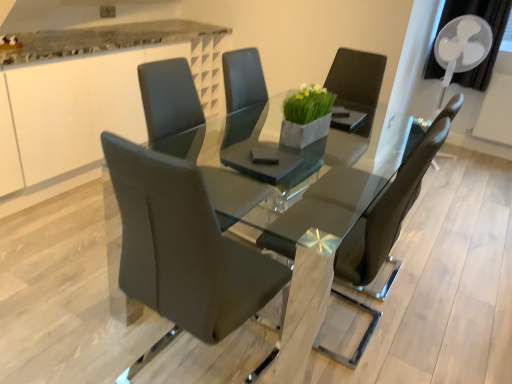
Locate an element on the screen. The image size is (512, 384). white plastic mechanical fan at upper right is located at coordinates (461, 46).

The width and height of the screenshot is (512, 384). What are the coordinates of `matte black chair at center, which is the 2th chair in front-to-back order` in the screenshot? It's located at (386, 218).

Locate an element on the screen. white plastic mechanical fan at upper right is located at coordinates (461, 46).

Which point is more distant from viewer, (458, 56) or (362, 254)?

Point (458, 56)

Based on the photo, considering the sizes of objects white plastic mechanical fan at upper right and matte black chair at center, which is counted as the 2th chair, starting from the back, in the image provided, who is thinner, white plastic mechanical fan at upper right or matte black chair at center, which is counted as the 2th chair, starting from the back,?

Thinner between the two is white plastic mechanical fan at upper right.

How distant is white plastic mechanical fan at upper right from matte black chair at center, which is counted as the 2th chair, starting from the back?

They are 7.02 feet apart.

How different are the orientations of white plastic mechanical fan at upper right and matte black chair at center, which is the 2th chair in front-to-back order, in degrees?

91.6 degrees.

Consider the image. Which object is positioned more to the left, matte black chair at center, which is the 2th chair in front-to-back order, or matte black chair at center, the third chair viewed from the back?

matte black chair at center, the third chair viewed from the back, is more to the left.

From the image's perspective, is matte black chair at center, which is the 2th chair in front-to-back order, positioned above or below matte black chair at center, the third chair viewed from the back?

Clearly, from the image's perspective, matte black chair at center, which is the 2th chair in front-to-back order, is above matte black chair at center, the third chair viewed from the back.

Between point (366, 264) and point (120, 181), which one is positioned in front?

The point (120, 181) is more forward.

Between matte black chair at center, which is the 2th chair in front-to-back order, and matte black chair at center, which is counted as the first chair, starting from the front, which one has less height?

matte black chair at center, which is counted as the first chair, starting from the front.

Consider the image. From a real-world perspective, does white plastic mechanical fan at upper right sit lower than matte black chair at center, which is counted as the first chair, starting from the front?

Incorrect, from a real-world perspective, white plastic mechanical fan at upper right is higher than matte black chair at center, which is counted as the first chair, starting from the front.

Considering the relative sizes of white plastic mechanical fan at upper right and matte black chair at center, which is counted as the first chair, starting from the front, in the image provided, is white plastic mechanical fan at upper right shorter than matte black chair at center, which is counted as the first chair, starting from the front,?

Yes, white plastic mechanical fan at upper right is shorter than matte black chair at center, which is counted as the first chair, starting from the front.

The width and height of the screenshot is (512, 384). What are the coordinates of `mechanical fan lying on the right of matte black chair at center, which is counted as the first chair, starting from the front` in the screenshot? It's located at (461, 46).

Between point (482, 30) and point (240, 312), which one is positioned behind?

The point (482, 30) is farther.

From the image's perspective, is white plastic mechanical fan at upper right on high-gloss black table at center?

Yes, from the image's perspective, white plastic mechanical fan at upper right is on top of high-gloss black table at center.

Is matte black chair at center, positioned as the third chair in front-to-back order, completely or partially inside white plastic mechanical fan at upper right?

No.

In the image, is white plastic mechanical fan at upper right positioned in front of or behind matte black chair at center, placed as the first chair when sorted from back to front?

white plastic mechanical fan at upper right is behind matte black chair at center, placed as the first chair when sorted from back to front.

Is point (456, 43) less distant than point (242, 146)?

No, (456, 43) is further to viewer.

Is high-gloss black table at center inside the boundaries of white glossy counter at upper left, or outside?

high-gloss black table at center is not inside white glossy counter at upper left, it's outside.

Can you confirm if high-gloss black table at center is wider than white glossy counter at upper left?

Correct, the width of high-gloss black table at center exceeds that of white glossy counter at upper left.

Does high-gloss black table at center come behind white glossy counter at upper left?

No, it is not.

Is point (410, 184) positioned behind point (41, 50)?

No, (410, 184) is closer to viewer.

Is matte black chair at center, positioned as the third chair in front-to-back order, touching white glossy counter at upper left?

matte black chair at center, positioned as the third chair in front-to-back order, is not next to white glossy counter at upper left, and they're not touching.

Looking at this image, is matte black chair at center, placed as the first chair when sorted from back to front, in front of or behind white glossy counter at upper left in the image?

In the image, matte black chair at center, placed as the first chair when sorted from back to front, appears in front of white glossy counter at upper left.

Considering the sizes of objects matte black chair at center, placed as the first chair when sorted from back to front, and white glossy counter at upper left in the image provided, who is taller, matte black chair at center, placed as the first chair when sorted from back to front, or white glossy counter at upper left?

white glossy counter at upper left.

I want to click on the 1st chair below the white glossy counter at upper left (from the image's perspective), so click(x=256, y=125).

The width and height of the screenshot is (512, 384). What are the coordinates of `the 2nd chair in front of the white plastic mechanical fan at upper right, starting your count from the anchor` in the screenshot? It's located at (386, 218).

Identify the location of chair below the matte black chair at center, which is counted as the first chair, starting from the front (from a real-world perspective). (386, 218).

When comparing their distances from matte black chair at center, positioned as the third chair in front-to-back order, does matte black chair at center, which is the 2th chair in front-to-back order, or high-gloss black table at center seem further?

matte black chair at center, which is the 2th chair in front-to-back order, lies further to matte black chair at center, positioned as the third chair in front-to-back order, than the other object.

From the image, which object appears to be nearer to white plastic mechanical fan at upper right, white glossy counter at upper left or matte black chair at center, placed as the first chair when sorted from back to front?

matte black chair at center, placed as the first chair when sorted from back to front.

Which object lies nearer to the anchor point white plastic mechanical fan at upper right, matte black chair at center, which is counted as the 2th chair, starting from the back, or white glossy counter at upper left?

The object closer to white plastic mechanical fan at upper right is matte black chair at center, which is counted as the 2th chair, starting from the back.

Based on the photo, considering their positions, is white plastic mechanical fan at upper right positioned closer to matte black chair at center, which is the 2th chair in front-to-back order, than matte black chair at center, which is counted as the first chair, starting from the front?

matte black chair at center, which is counted as the first chair, starting from the front, is positioned closer to the anchor matte black chair at center, which is the 2th chair in front-to-back order.

Considering their positions, is white glossy counter at upper left positioned closer to matte black chair at center, which is counted as the first chair, starting from the front, than white plastic mechanical fan at upper right?

white glossy counter at upper left.

Based on their spatial positions, is high-gloss black table at center or white plastic mechanical fan at upper right closer to white glossy counter at upper left?

high-gloss black table at center lies closer to white glossy counter at upper left than the other object.

Looking at the image, which one is located closer to matte black chair at center, placed as the first chair when sorted from back to front, high-gloss black table at center or matte black chair at center, which is counted as the 2th chair, starting from the back?

Among the two, high-gloss black table at center is located nearer to matte black chair at center, placed as the first chair when sorted from back to front.

From the image, which object appears to be farther from white plastic mechanical fan at upper right, matte black chair at center, placed as the first chair when sorted from back to front, or matte black chair at center, which is counted as the 2th chair, starting from the back?

matte black chair at center, which is counted as the 2th chair, starting from the back.

This screenshot has height=384, width=512. Find the location of `chair between matte black chair at center, which is counted as the first chair, starting from the front, and matte black chair at center, positioned as the third chair in front-to-back order, in the front-back direction`. chair between matte black chair at center, which is counted as the first chair, starting from the front, and matte black chair at center, positioned as the third chair in front-to-back order, in the front-back direction is located at coordinates (386, 218).

Identify the location of table located between matte black chair at center, the third chair viewed from the back, and matte black chair at center, which is the 2th chair in front-to-back order, in the left-right direction. The width and height of the screenshot is (512, 384). (217, 244).

In order to click on table located between white glossy counter at upper left and matte black chair at center, which is the 2th chair in front-to-back order, in the left-right direction in this screenshot , I will do `click(217, 244)`.

Identify the location of table located between white glossy counter at upper left and white plastic mechanical fan at upper right in the left-right direction. (217, 244).